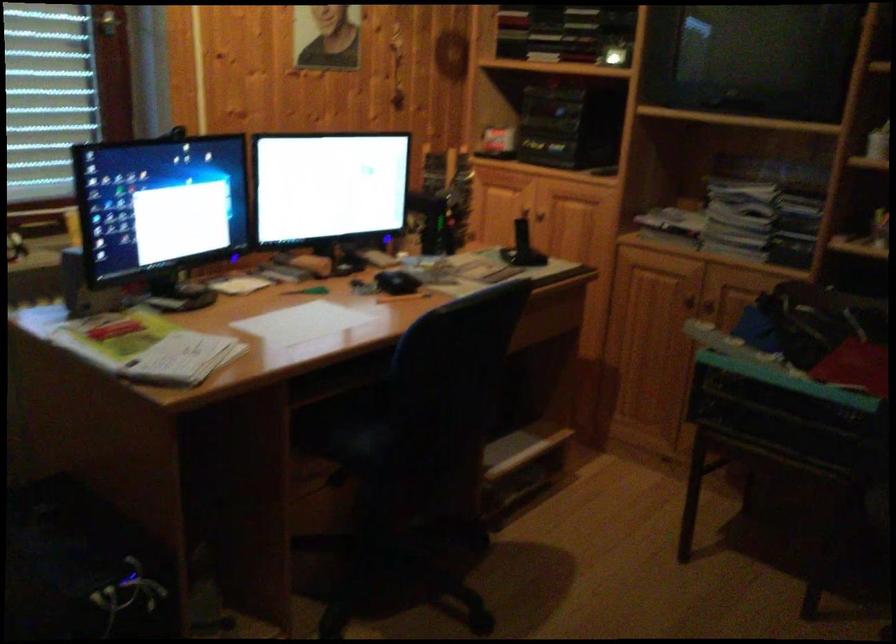
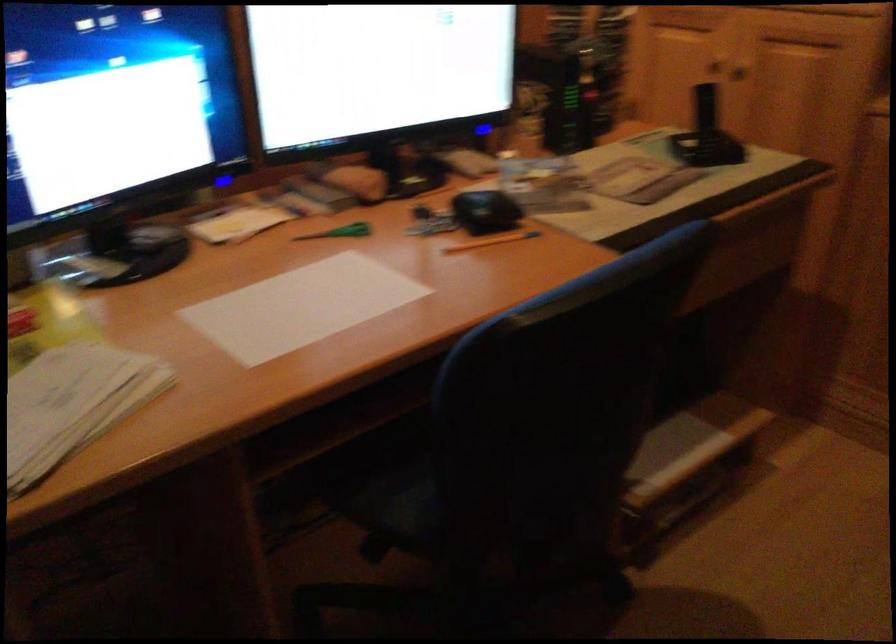
In the second image, find the point that corresponds to [406,295] in the first image.

(493, 240)